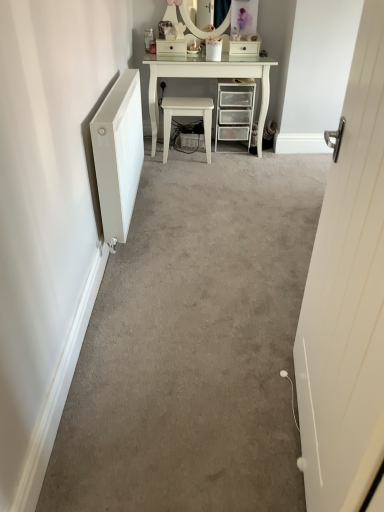
Question: Would you say white glossy vanity at upper center is a long distance from white glossy stool at center?

Choices:
 (A) no
 (B) yes

Answer: (A)

Question: From a real-world perspective, is white glossy vanity at upper center under white glossy stool at center?

Choices:
 (A) no
 (B) yes

Answer: (A)

Question: Considering the relative positions of white glossy vanity at upper center and white glossy stool at center in the image provided, is white glossy vanity at upper center behind white glossy stool at center?

Choices:
 (A) yes
 (B) no

Answer: (B)

Question: Is white glossy vanity at upper center directly adjacent to white glossy stool at center?

Choices:
 (A) no
 (B) yes

Answer: (A)

Question: Can you confirm if white glossy vanity at upper center is bigger than white glossy stool at center?

Choices:
 (A) no
 (B) yes

Answer: (B)

Question: Can you confirm if white glossy vanity at upper center is positioned to the right of white glossy stool at center?

Choices:
 (A) yes
 (B) no

Answer: (A)

Question: Is white glossy vanity at upper center to the left of white glossy drawer at upper center, acting as the 1th drawer starting from the right, from the viewer's perspective?

Choices:
 (A) yes
 (B) no

Answer: (A)

Question: Does white glossy vanity at upper center appear on the right side of white glossy drawer at upper center, the 2th drawer viewed from the left?

Choices:
 (A) yes
 (B) no

Answer: (B)

Question: Does white glossy vanity at upper center have a lesser height compared to white glossy drawer at upper center, acting as the 1th drawer starting from the right?

Choices:
 (A) yes
 (B) no

Answer: (B)

Question: Is white glossy vanity at upper center outside white glossy drawer at upper center, acting as the 1th drawer starting from the right?

Choices:
 (A) yes
 (B) no

Answer: (A)

Question: Considering the relative positions of white glossy vanity at upper center and white glossy drawer at upper center, acting as the 1th drawer starting from the right, in the image provided, is white glossy vanity at upper center behind white glossy drawer at upper center, acting as the 1th drawer starting from the right,?

Choices:
 (A) yes
 (B) no

Answer: (B)

Question: From the image's perspective, is white glossy vanity at upper center located beneath white glossy drawer at upper center, acting as the 1th drawer starting from the right?

Choices:
 (A) no
 (B) yes

Answer: (B)

Question: Is white glossy drawer at upper center, acting as the 1th drawer starting from the left, facing away from white glossy drawer at upper center, acting as the 1th drawer starting from the right?

Choices:
 (A) yes
 (B) no

Answer: (B)